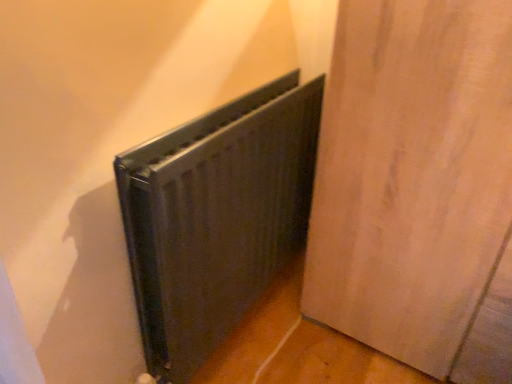
Question: Choose the correct answer: Is matte wood door at center inside black matte radiator at center or outside it?

Choices:
 (A) inside
 (B) outside

Answer: (B)

Question: Is matte wood door at center to the left or to the right of black matte radiator at center in the image?

Choices:
 (A) left
 (B) right

Answer: (B)

Question: Considering their positions, is matte wood door at center located in front of or behind black matte radiator at center?

Choices:
 (A) front
 (B) behind

Answer: (A)

Question: From a real-world perspective, is black matte radiator at center positioned above or below matte wood door at center?

Choices:
 (A) below
 (B) above

Answer: (A)

Question: Considering their positions, is black matte radiator at center located in front of or behind matte wood door at center?

Choices:
 (A) front
 (B) behind

Answer: (B)

Question: Is black matte radiator at center bigger or smaller than matte wood door at center?

Choices:
 (A) big
 (B) small

Answer: (B)

Question: Looking at their shapes, would you say black matte radiator at center is wider or thinner than matte wood door at center?

Choices:
 (A) thin
 (B) wide

Answer: (A)